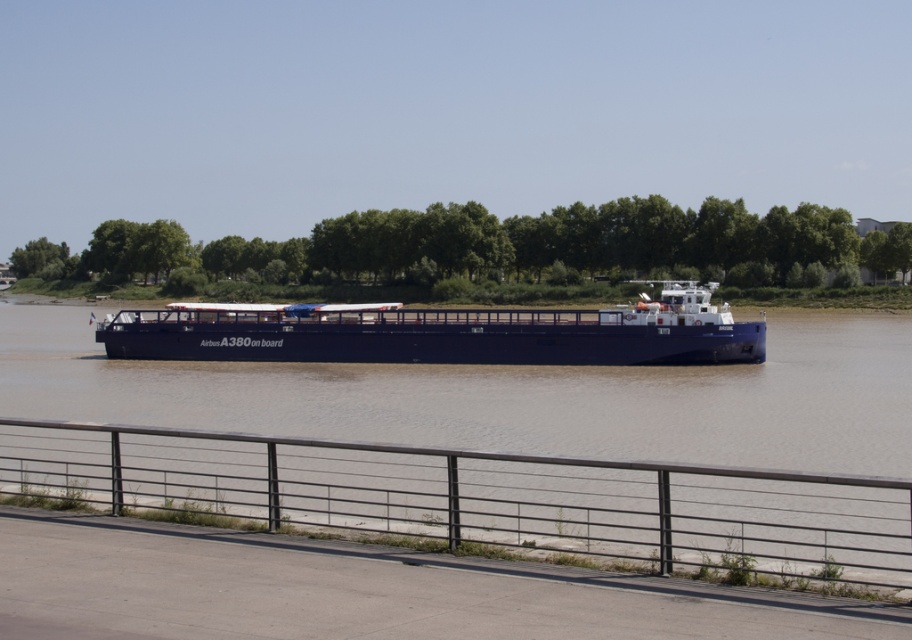
Is metal fence at lower center bigger than blue matte cargo ship at center?

No, metal fence at lower center is not bigger than blue matte cargo ship at center.

Who is shorter, metal fence at lower center or blue matte cargo ship at center?

With less height is metal fence at lower center.

In order to click on metal fence at lower center in this screenshot , I will do `click(483, 497)`.